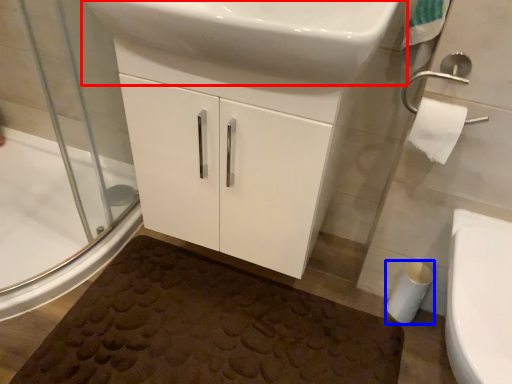
Question: Which point is closer to the camera, sink (highlighted by a red box) or toilet paper (highlighted by a blue box)?

Choices:
 (A) sink
 (B) toilet paper

Answer: (A)